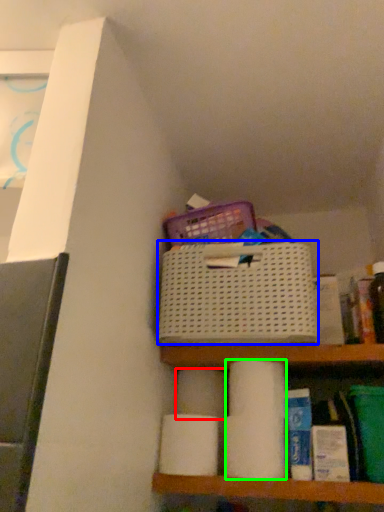
Question: Estimate the real-world distances between objects in this image. Which object is closer to toilet paper (highlighted by a red box), basket (highlighted by a blue box) or toilet paper (highlighted by a green box)?

Choices:
 (A) basket
 (B) toilet paper

Answer: (B)